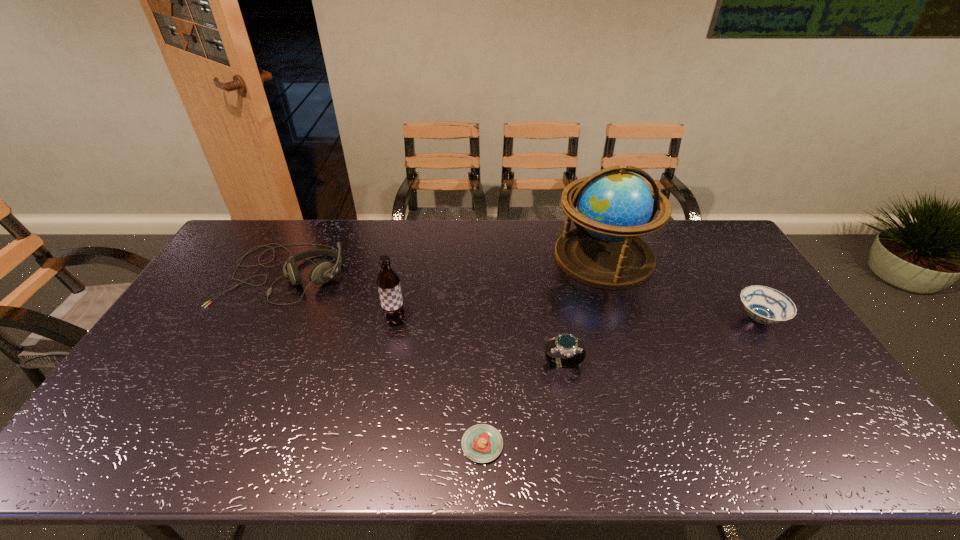
Image resolution: width=960 pixels, height=540 pixels. Find the location of `vacant region that satisfies the following two spatial constraints: 1. on the front side of the third object from left to right; 2. on the left side of the fifth shortest object`. vacant region that satisfies the following two spatial constraints: 1. on the front side of the third object from left to right; 2. on the left side of the fifth shortest object is located at coordinates (370, 444).

Where is `free space that satisfies the following two spatial constraints: 1. on the outer surface of the watch; 2. on the left side of the headset`? free space that satisfies the following two spatial constraints: 1. on the outer surface of the watch; 2. on the left side of the headset is located at coordinates (239, 364).

Where is `blank area in the image that satisfies the following two spatial constraints: 1. on the front side of the watch; 2. on the left side of the fifth object from right to left`? blank area in the image that satisfies the following two spatial constraints: 1. on the front side of the watch; 2. on the left side of the fifth object from right to left is located at coordinates (386, 364).

Find the location of a particular element. vacant space that satisfies the following two spatial constraints: 1. on the outer surface of the fifth farthest object; 2. on the left side of the headset is located at coordinates (239, 364).

Locate an element on the screen. free point that satisfies the following two spatial constraints: 1. on the outer surface of the pastry; 2. on the left side of the headset is located at coordinates (198, 444).